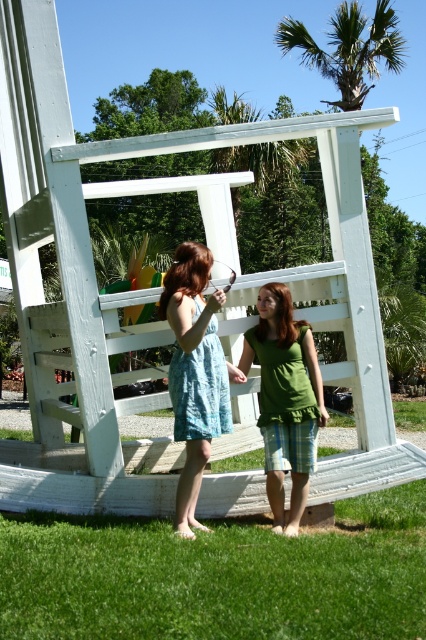
You are a photographer trying to capture both the light blue cotton dress at center and the green fabric shirt at center in a single frame. Which clothing item should you focus on first to ensure they both fit in the photo?

The light blue cotton dress at center is much taller than the green fabric shirt at center, so you should focus on the light blue cotton dress at center first to ensure both fit in the photo.

You are a photographer trying to capture a photo of both the light blue cotton dress at center and the green fabric shirt at center. The camera you are using has a minimum focus distance of 22 inches. Will you be able to focus on both subjects without moving the camera?

The distance between the light blue cotton dress at center and the green fabric shirt at center is 21.58 inches, which is slightly less than the camera minimum focus distance of 22 inches. Therefore, the camera may not be able to focus on both subjects simultaneously without moving closer or adjusting the focus settings.